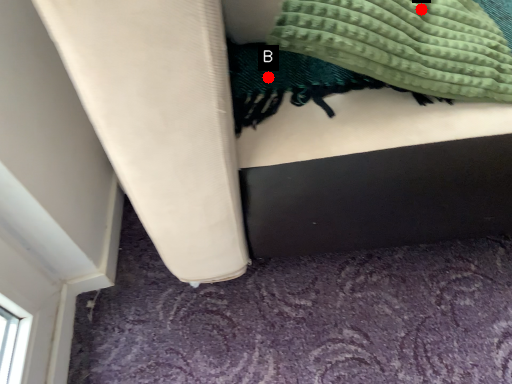
Question: Two points are circled on the image, labeled by A and B beside each circle. Which point is further to the camera?

Choices:
 (A) A is further
 (B) B is further

Answer: (B)